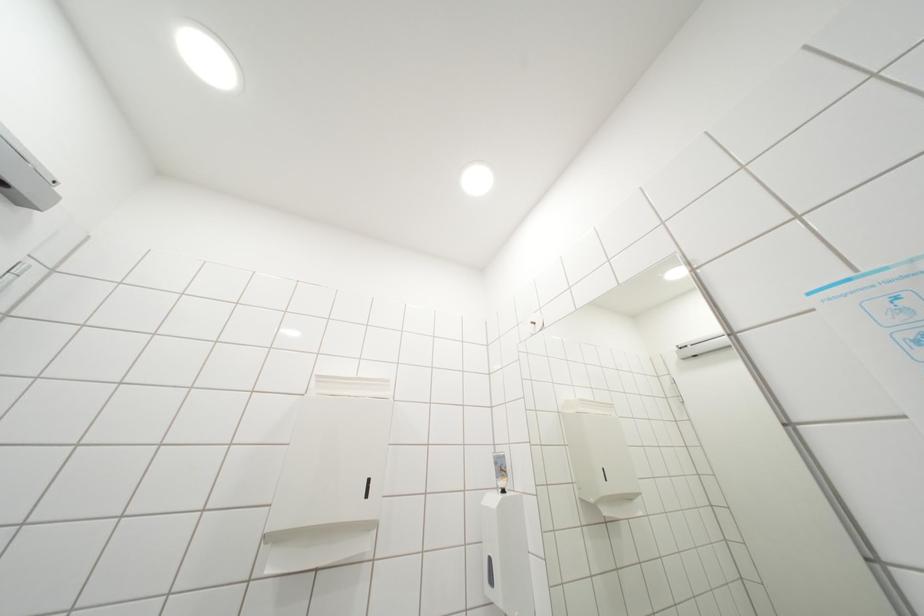
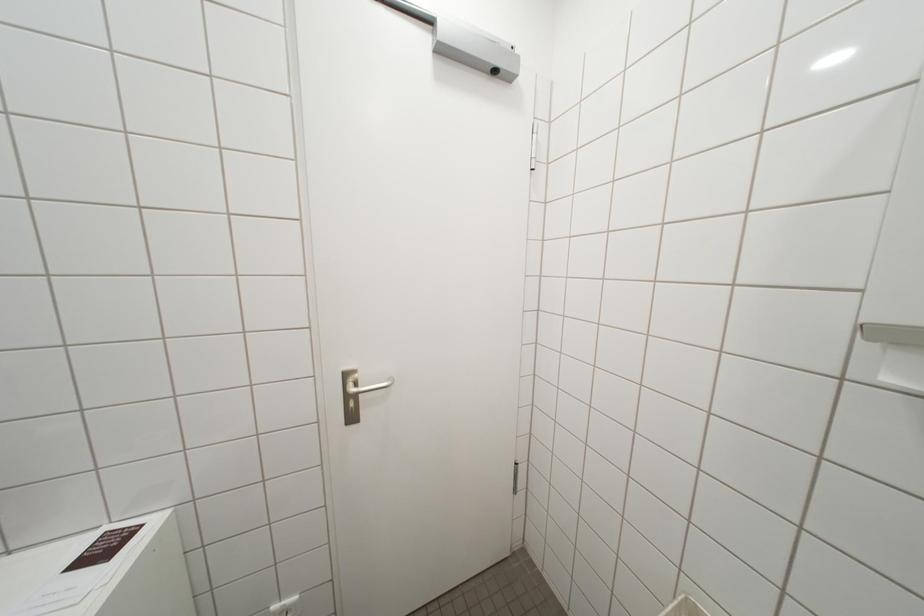
Question: The camera is either moving clockwise (left) or counter-clockwise (right) around the object. The first image is from the beginning of the video and the second image is from the end. Is the camera moving left or right when shooting the video?

Choices:
 (A) Left
 (B) Right

Answer: (B)